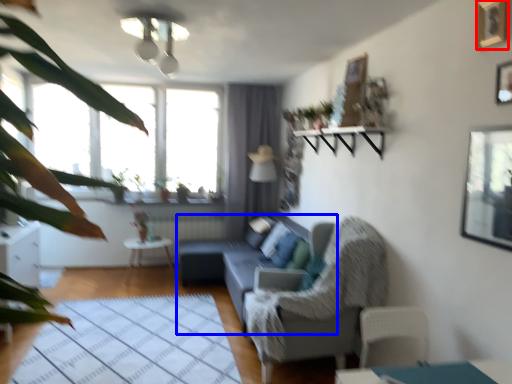
Question: Which point is further to the camera, picture frame (highlighted by a red box) or studio couch (highlighted by a blue box)?

Choices:
 (A) picture frame
 (B) studio couch

Answer: (B)